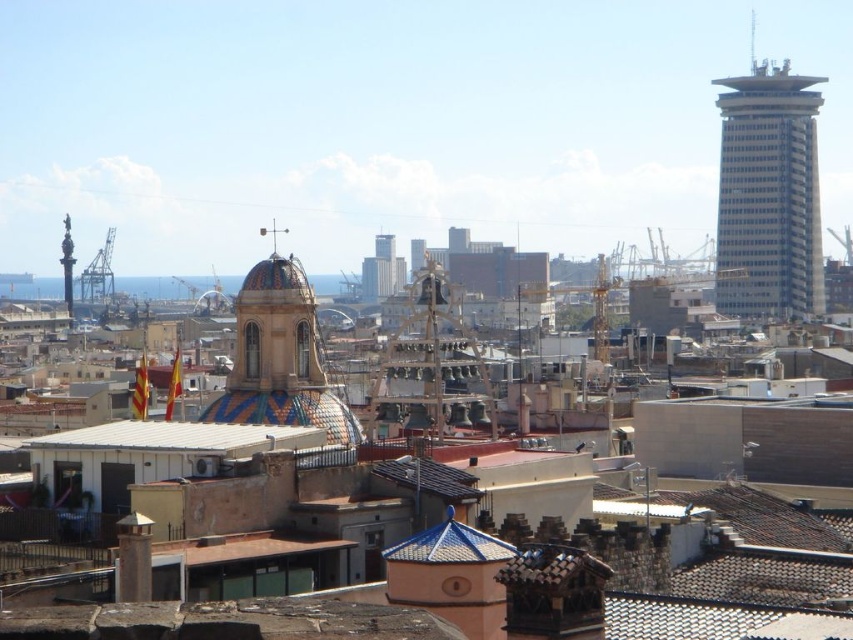
Question: Can you confirm if smooth glass skyscraper at right is smaller than matte glass skyscraper at center?

Choices:
 (A) yes
 (B) no

Answer: (B)

Question: Which object appears farthest from the camera in this image?

Choices:
 (A) blue glazed tiles at center
 (B) white matte roof at center

Answer: (B)

Question: Estimate the real-world distances between objects in this image. Which object is closer to the smooth glass skyscraper at right?

Choices:
 (A) blue glazed tiles at center
 (B) white matte roof at center

Answer: (B)

Question: Is smooth glass skyscraper at right behind matte glass skyscraper at center?

Choices:
 (A) yes
 (B) no

Answer: (B)

Question: Is white matte roof at center above matte glass skyscraper at center?

Choices:
 (A) no
 (B) yes

Answer: (A)

Question: Among these points, which one is nearest to the camera?

Choices:
 (A) (424, 250)
 (B) (398, 561)

Answer: (B)